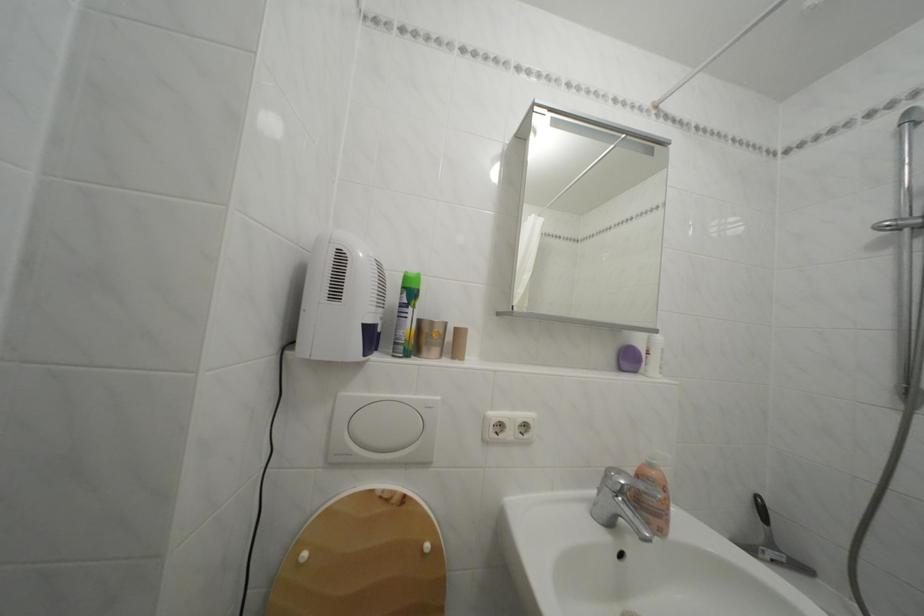
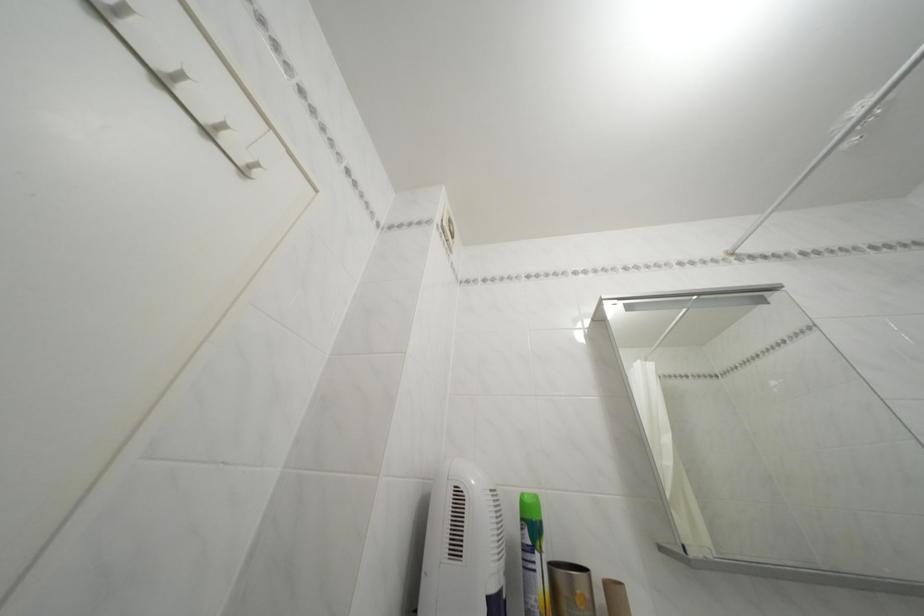
The point at (x=465, y=334) is marked in the first image. Where is the corresponding point in the second image?

(614, 591)